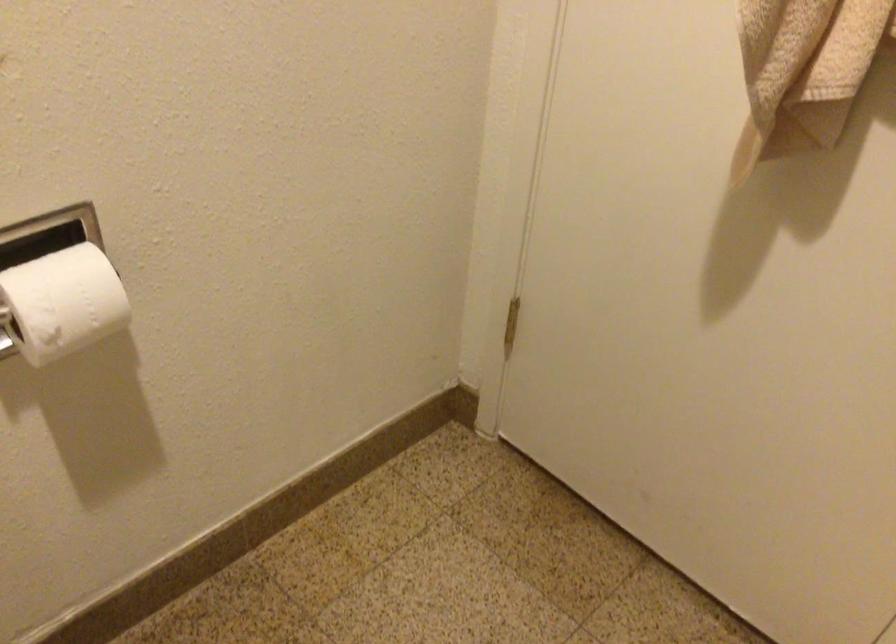
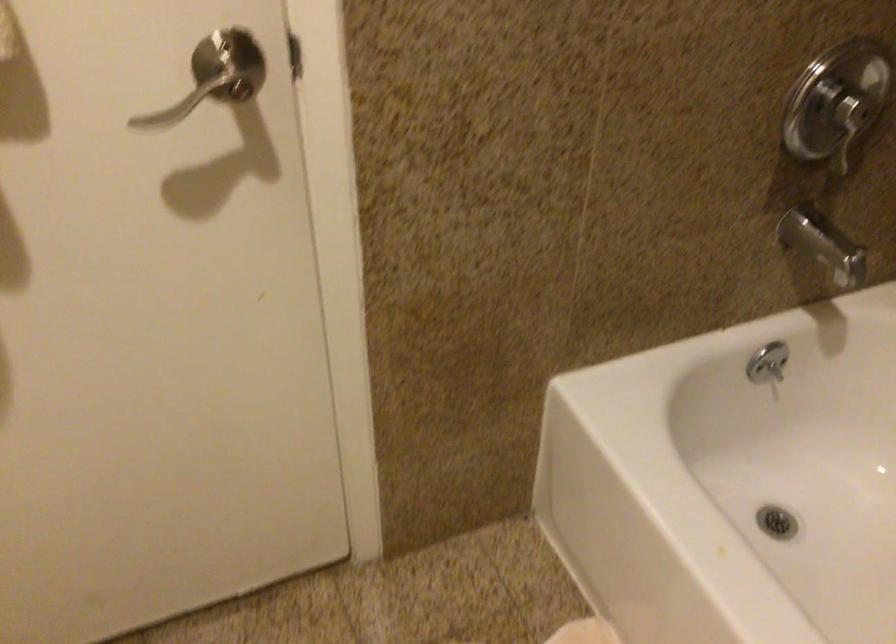
How did the camera likely rotate?

The camera's rotation is toward right-down.